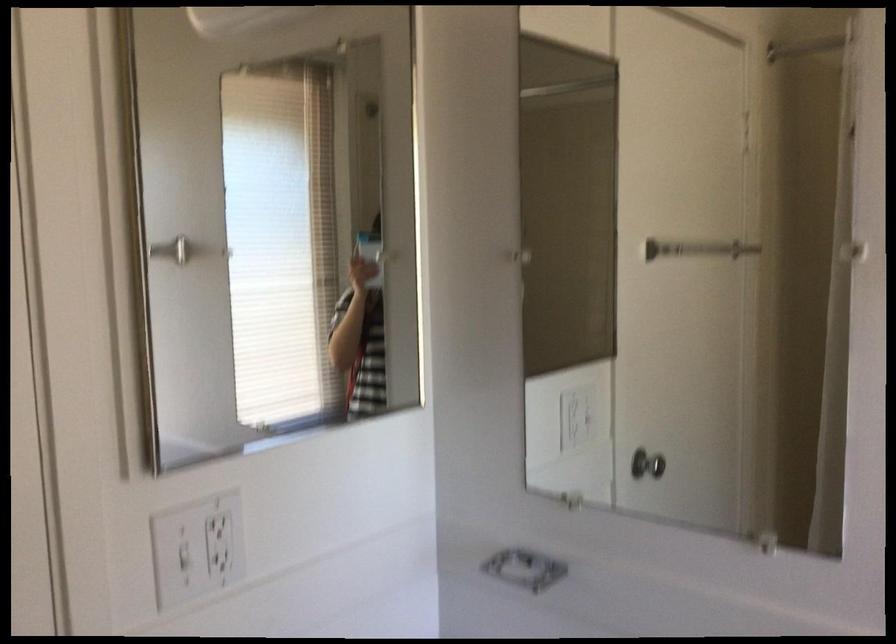
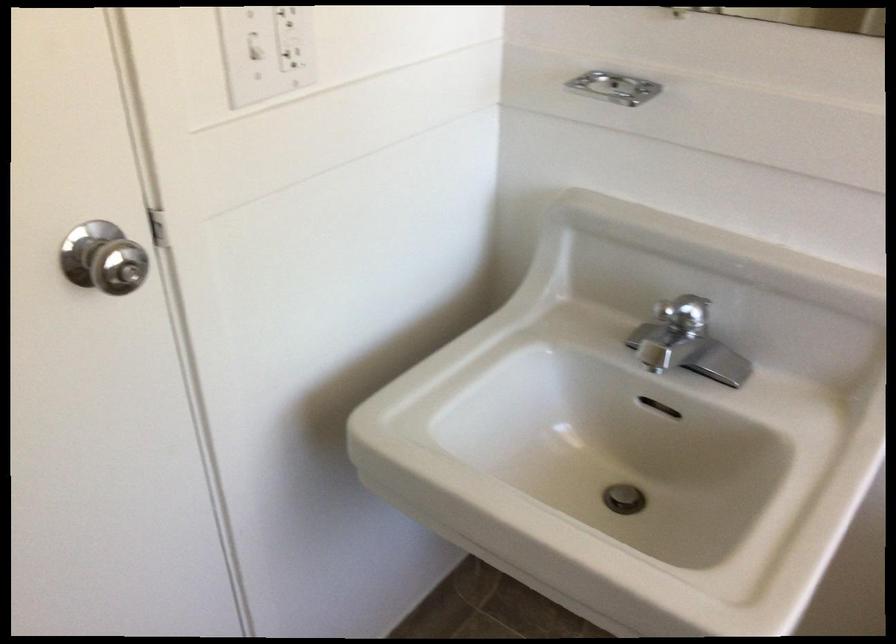
In the second image, find the point that corresponds to pixel 177 564 in the first image.

(254, 46)